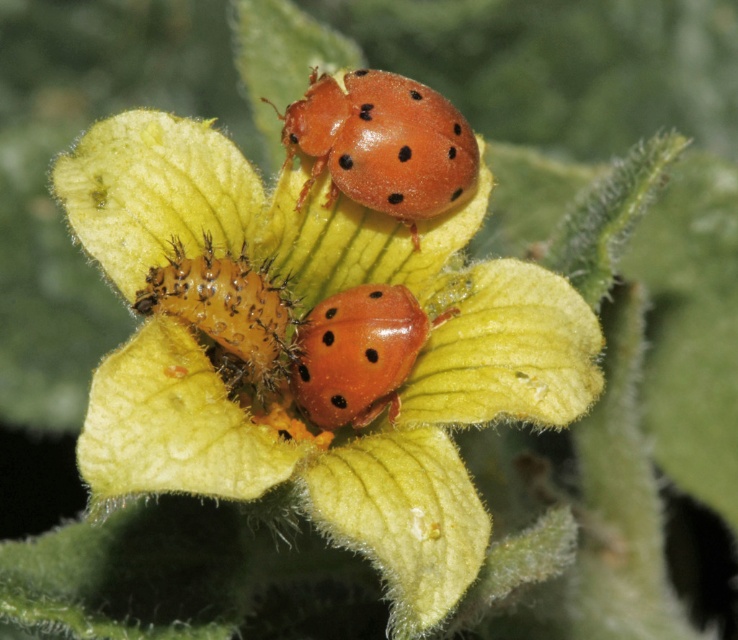
Is smooth yellow flower at center to the left of matte orange beetle at upper center from the viewer's perspective?

Yes, smooth yellow flower at center is to the left of matte orange beetle at upper center.

Is smooth yellow flower at center above matte orange beetle at upper center?

No, smooth yellow flower at center is not above matte orange beetle at upper center.

Does point (162, 486) lie behind point (430, 156)?

That is False.

The height and width of the screenshot is (640, 738). I want to click on smooth yellow flower at center, so click(x=306, y=307).

Between matte orange beetle at upper center and shiny orange ladybird at center, which one appears on the right side from the viewer's perspective?

Positioned to the right is matte orange beetle at upper center.

Which is more to the left, matte orange beetle at upper center or shiny orange ladybird at center?

shiny orange ladybird at center is more to the left.

The height and width of the screenshot is (640, 738). What are the coordinates of `matte orange beetle at upper center` in the screenshot? It's located at (382, 144).

Which is below, matte orange beetle at upper center or fuzzy orange caterpillar at center?

fuzzy orange caterpillar at center

Which is behind, point (466, 182) or point (268, 332)?

The point (466, 182) is behind.

Is point (421, 200) closer to viewer compared to point (179, 310)?

No, it is behind (179, 310).

Where is `matte orange beetle at upper center`? The height and width of the screenshot is (640, 738). matte orange beetle at upper center is located at coordinates (382, 144).